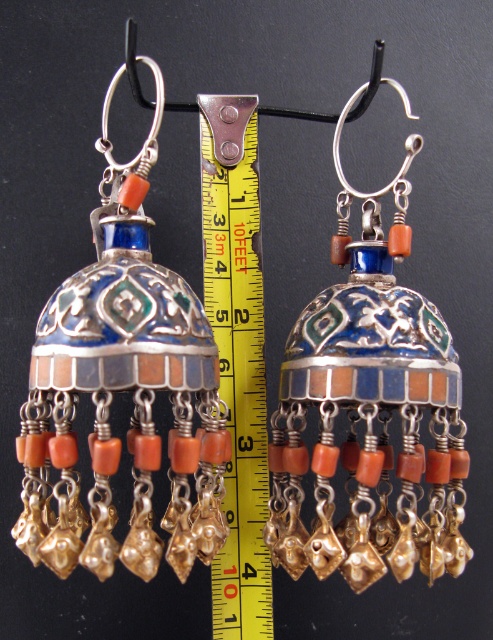
Between matte silver earrings at left and enamel and silver earrings at center, which one is positioned higher?

matte silver earrings at left is above.

Measure the distance between point (213, 456) and camera.

Point (213, 456) is 35.79 inches away from camera.

Locate an element on the screen. The height and width of the screenshot is (640, 493). matte silver earrings at left is located at coordinates (117, 381).

I want to click on matte silver earrings at left, so click(x=117, y=381).

You are a GUI agent. You are given a task and a screenshot of the screen. Output one action in this format:
    pyautogui.click(x=<x>, y=<y>)
    Task: Click on the matte silver earrings at left
    This screenshot has height=640, width=493.
    Given the screenshot: What is the action you would take?
    pyautogui.click(x=117, y=381)

Does matte silver earrings at left appear on the left side of yellow/yellowish plastic ruler at center?

Correct, you'll find matte silver earrings at left to the left of yellow/yellowish plastic ruler at center.

Who is more forward, (x=41, y=340) or (x=217, y=577)?

Positioned in front is point (x=41, y=340).

At what (x,y) coordinates should I click in order to perform the action: click on matte silver earrings at left. Please return your answer as a coordinate pair (x, y). Looking at the image, I should click on (117, 381).

Between enamel and silver earrings at center and yellow/yellowish plastic ruler at center, which one is positioned higher?

enamel and silver earrings at center

Does enamel and silver earrings at center have a greater width compared to yellow/yellowish plastic ruler at center?

Correct, the width of enamel and silver earrings at center exceeds that of yellow/yellowish plastic ruler at center.

Which is behind, point (351, 401) or point (260, 308)?

Point (260, 308)

You are a GUI agent. You are given a task and a screenshot of the screen. Output one action in this format:
    pyautogui.click(x=<x>, y=<y>)
    Task: Click on the enamel and silver earrings at center
    
    Given the screenshot: What is the action you would take?
    pyautogui.click(x=372, y=403)